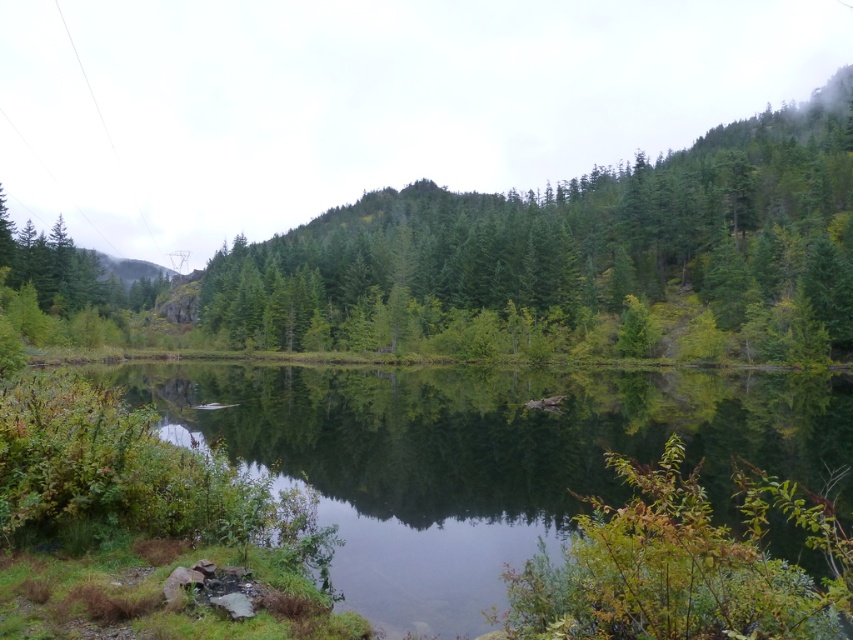
Based on the photo, is green glossy water at center closer to camera compared to green matte tree at center?

That is True.

Between green glossy water at center and green matte tree at center, which one has less height?

green glossy water at center is shorter.

Is point (404, 456) more distant than point (381, 214)?

No, it is in front of (381, 214).

Image resolution: width=853 pixels, height=640 pixels. I want to click on green glossy water at center, so [483, 458].